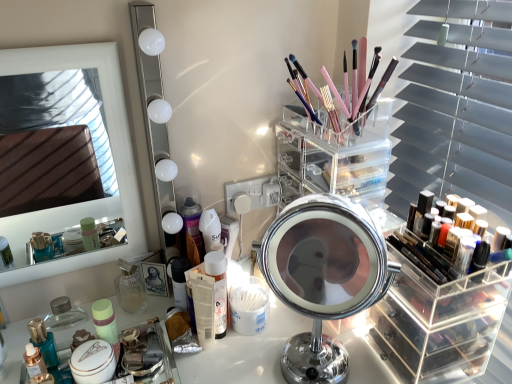
Where is `vacant area in front of white glossy mirror at upper left, the second mirror viewed from the left`? vacant area in front of white glossy mirror at upper left, the second mirror viewed from the left is located at coordinates (141, 350).